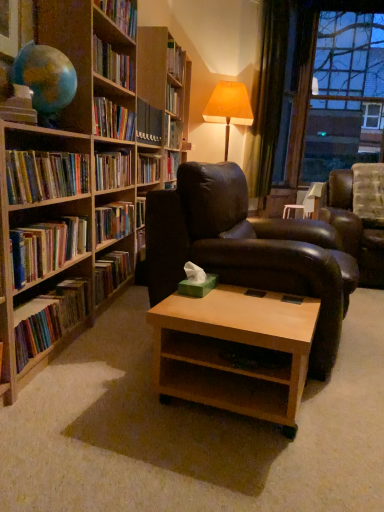
Find the location of a particular element. The image size is (384, 512). free spot to the right of light brown wood coffee table at center is located at coordinates point(342,411).